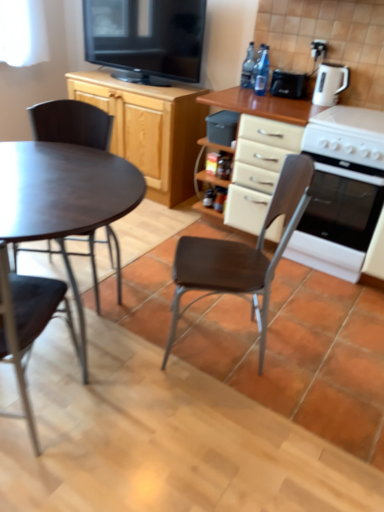
This screenshot has width=384, height=512. I want to click on empty space that is to the right of brown leather chair at center, the third chair viewed from the left, so click(x=311, y=351).